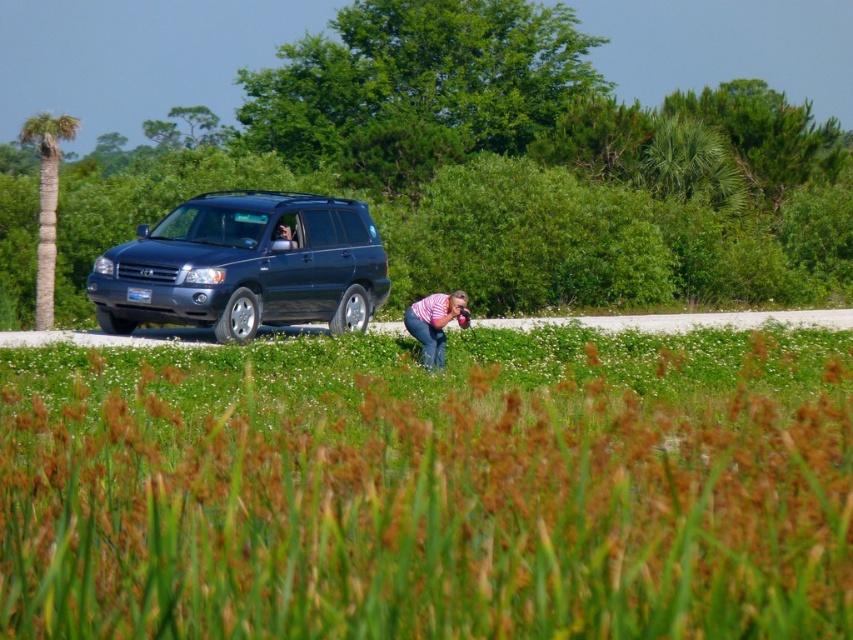
Question: Considering the real-world distances, which object is closest to the shiny dark blue suv at center?

Choices:
 (A) pink striped shirt at center
 (B) green grass at center

Answer: (A)

Question: Does green grass at center have a greater width compared to shiny dark blue suv at center?

Choices:
 (A) yes
 (B) no

Answer: (A)

Question: Does shiny dark blue suv at center lie in front of pink striped shirt at center?

Choices:
 (A) yes
 (B) no

Answer: (B)

Question: Does shiny dark blue suv at center appear under pink striped shirt at center?

Choices:
 (A) no
 (B) yes

Answer: (A)

Question: Which object is positioned farthest from the shiny dark blue suv at center?

Choices:
 (A) green grass at center
 (B) pink striped shirt at center

Answer: (A)

Question: Which point appears closest to the camera in this image?

Choices:
 (A) (670, 520)
 (B) (320, 310)

Answer: (A)